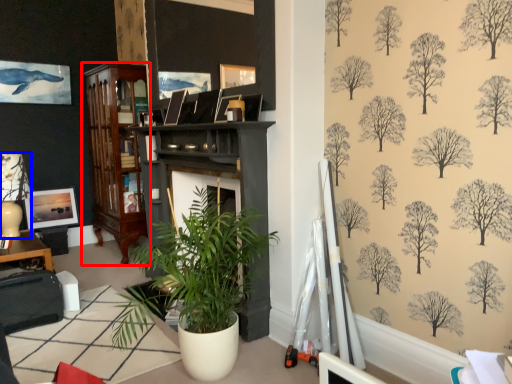
Question: Which point is closer to the camera, cabinetry (highlighted by a red box) or lamp (highlighted by a blue box)?

Choices:
 (A) cabinetry
 (B) lamp

Answer: (B)